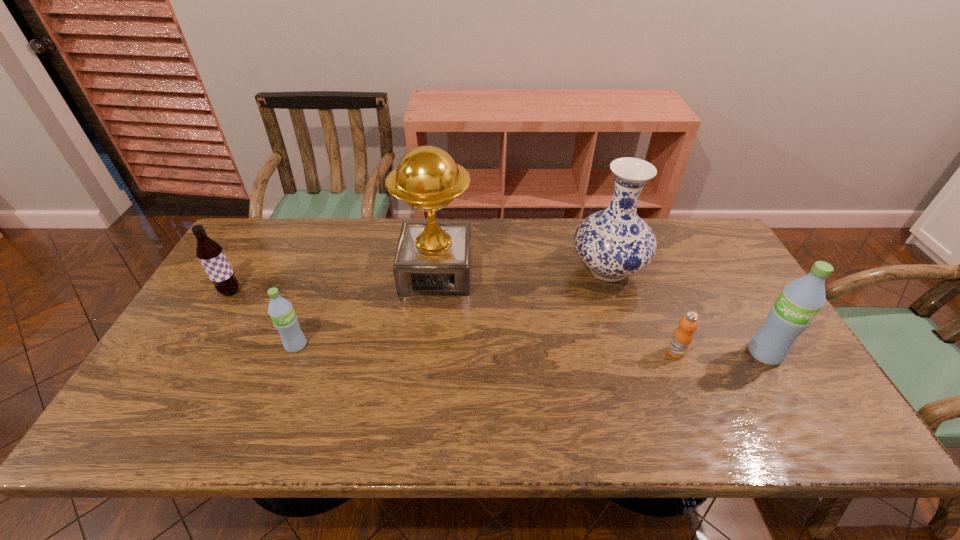
Locate an element on the screen. The height and width of the screenshot is (540, 960). vacant space at the left edge of the desktop is located at coordinates pos(233,306).

Locate an element on the screen. free space at the far left corner of the desktop is located at coordinates (289, 231).

In the image, there is a desktop. Identify the location of blank space at the near left corner. (165, 376).

The height and width of the screenshot is (540, 960). What are the coordinates of `vacant space at the far right corner of the desktop` in the screenshot? It's located at (707, 233).

In the image, there is a desktop. What are the coordinates of `vacant region at the near right corner` in the screenshot? It's located at (808, 397).

In order to click on free space between the leftmost object and the shortest object in this screenshot , I will do `click(453, 322)`.

Identify the location of unoccupied area between the rightmost object and the left water bottle. (530, 349).

Where is `free space between the left water bottle and the root beer`? The height and width of the screenshot is (540, 960). free space between the left water bottle and the root beer is located at coordinates (263, 319).

Image resolution: width=960 pixels, height=540 pixels. I want to click on vacant space that's between the shorter water bottle and the third object from left to right, so click(x=366, y=308).

Locate an element on the screen. Image resolution: width=960 pixels, height=540 pixels. free space between the orange juice and the leftmost object is located at coordinates (453, 322).